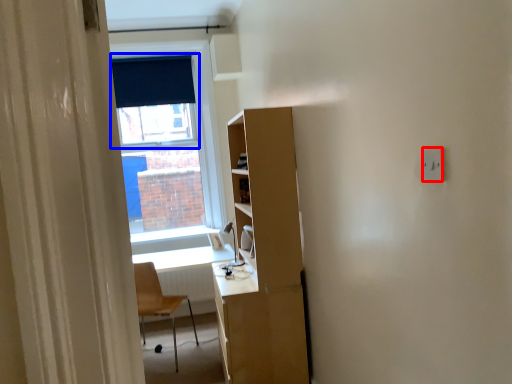
Question: Among these objects, which one is nearest to the camera, electric outlet (highlighted by a red box) or window screen (highlighted by a blue box)?

Choices:
 (A) electric outlet
 (B) window screen

Answer: (A)